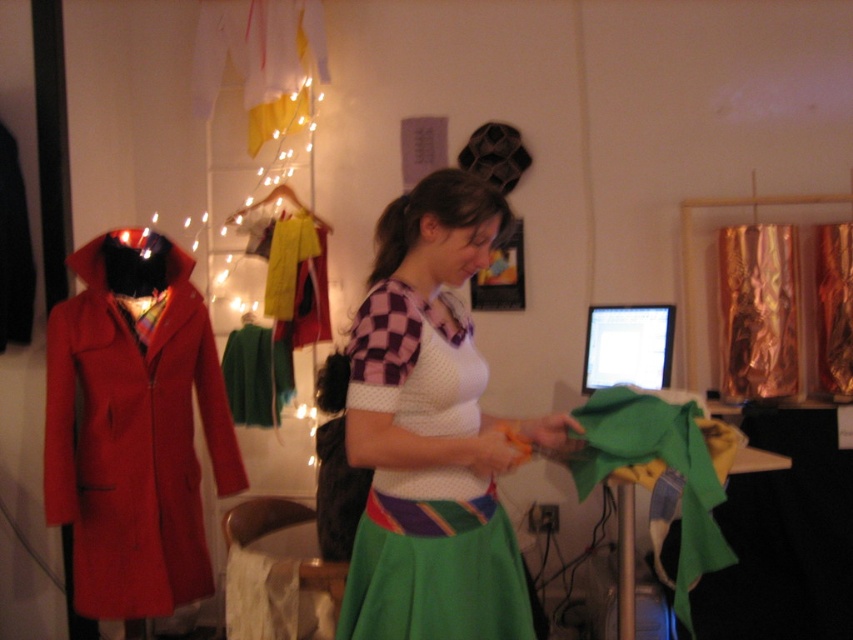
Question: Can you confirm if white mesh top at center is positioned to the left of matte red coat at left?

Choices:
 (A) no
 (B) yes

Answer: (A)

Question: In this image, where is matte red coat at left located relative to green felt at center?

Choices:
 (A) above
 (B) below

Answer: (A)

Question: Can you confirm if white mesh top at center is thinner than matte red coat at left?

Choices:
 (A) yes
 (B) no

Answer: (A)

Question: Among these objects, which one is farthest from the camera?

Choices:
 (A) green felt at center
 (B) matte red coat at left
 (C) white mesh top at center

Answer: (B)

Question: Which object appears closest to the camera in this image?

Choices:
 (A) matte red coat at left
 (B) white mesh top at center
 (C) green felt at center

Answer: (B)

Question: Which point is closer to the camera taking this photo?

Choices:
 (A) (193, 346)
 (B) (651, 442)

Answer: (B)